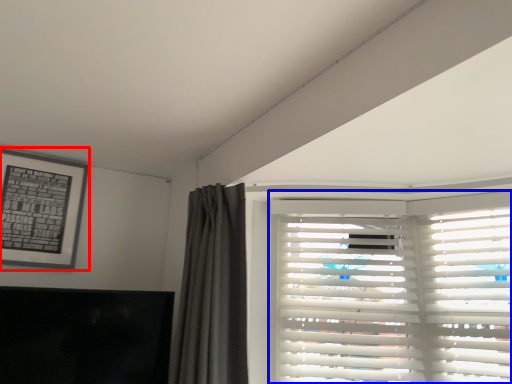
Question: Among these objects, which one is nearest to the camera, picture frame (highlighted by a red box) or window blind (highlighted by a blue box)?

Choices:
 (A) picture frame
 (B) window blind

Answer: (B)